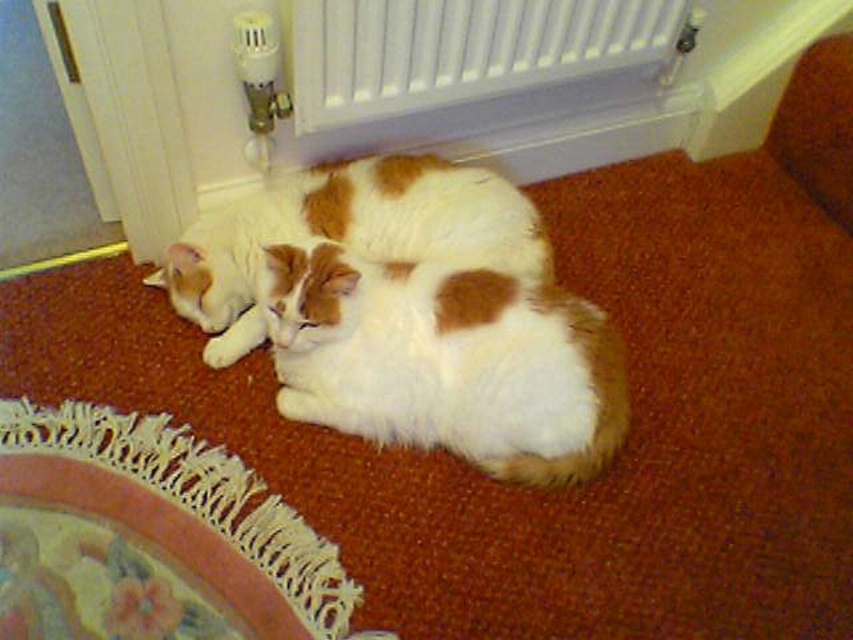
Consider the image. Does white fluffy cat at center appear on the right side of white plastic radiator at upper center?

No, white fluffy cat at center is not to the right of white plastic radiator at upper center.

Does white fluffy cat at center appear on the left side of white plastic radiator at upper center?

Indeed, white fluffy cat at center is positioned on the left side of white plastic radiator at upper center.

Which is behind, point (286, 348) or point (549, 61)?

The point (549, 61) is behind.

Where is `white fluffy cat at center`? white fluffy cat at center is located at coordinates (445, 362).

Between white plastic radiator at upper center and white lace mat at lower left, which one has more height?

Standing taller between the two is white lace mat at lower left.

Does point (547, 64) come in front of point (219, 532)?

No, it is behind (219, 532).

Does point (358, 97) come closer to viewer compared to point (271, 502)?

No.

Identify the location of white plastic radiator at upper center. (469, 58).

What do you see at coordinates (347, 234) in the screenshot? I see `white soft fur cat at center` at bounding box center [347, 234].

What do you see at coordinates (347, 234) in the screenshot? I see `white soft fur cat at center` at bounding box center [347, 234].

Image resolution: width=853 pixels, height=640 pixels. What are the coordinates of `white soft fur cat at center` in the screenshot? It's located at (347, 234).